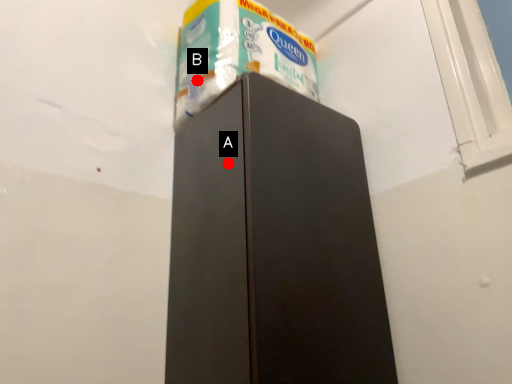
Question: Two points are circled on the image, labeled by A and B beside each circle. Among these points, which one is nearest to the camera?

Choices:
 (A) A is closer
 (B) B is closer

Answer: (A)